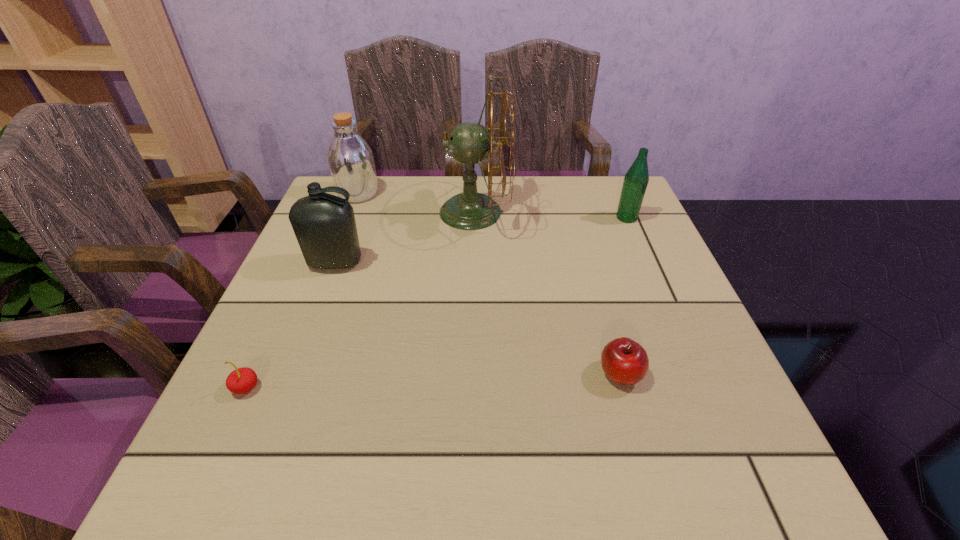
At what (x,y) coordinates should I click in order to perform the action: click on fan. Please return your answer as a coordinate pair (x, y). This screenshot has height=540, width=960. Looking at the image, I should click on (470, 210).

The image size is (960, 540). Find the location of `the third object from right to left`. the third object from right to left is located at coordinates (470, 210).

Where is `the farthest bottle`? the farthest bottle is located at coordinates (350, 158).

Locate an element on the screen. the nearest bottle is located at coordinates (324, 224).

Locate an element on the screen. the rightmost bottle is located at coordinates (636, 179).

The width and height of the screenshot is (960, 540). In order to click on the rightmost object in this screenshot , I will do `click(636, 179)`.

You are a GUI agent. You are given a task and a screenshot of the screen. Output one action in this format:
    pyautogui.click(x=<x>, y=<y>)
    Task: Click on the apple
    
    Given the screenshot: What is the action you would take?
    pyautogui.click(x=624, y=361)

Find the location of a particular element. cherry is located at coordinates (242, 380).

Locate an element on the screen. The width and height of the screenshot is (960, 540). free point located 0.350m in front of the third object from right to left, directing air flow is located at coordinates (640, 212).

At what (x,y) coordinates should I click in order to perform the action: click on vacant space located 0.340m on the right of the farthest bottle. Please return your answer as a coordinate pair (x, y). The height and width of the screenshot is (540, 960). Looking at the image, I should click on (500, 193).